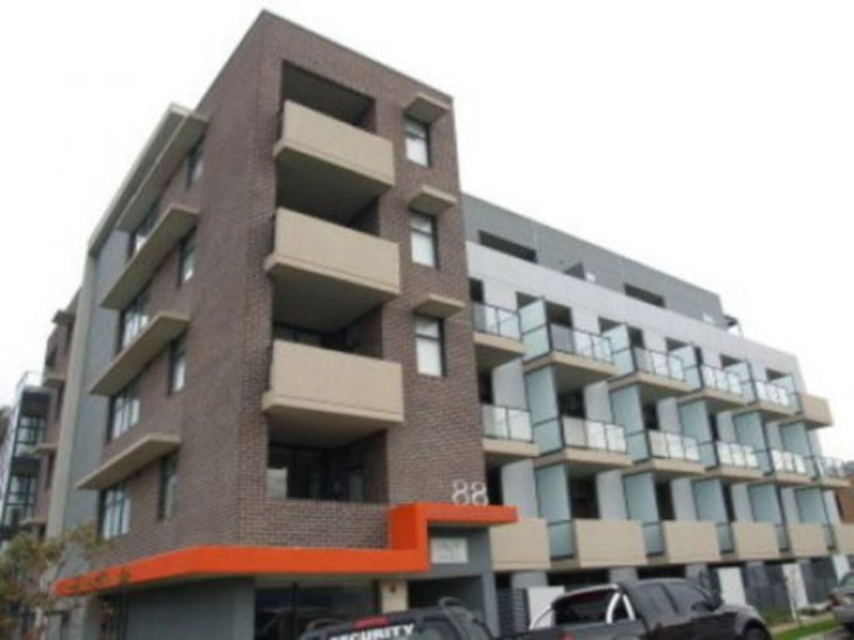
Between shiny black car at lower center and black rubber security car at lower center, which one appears on the left side from the viewer's perspective?

black rubber security car at lower center is more to the left.

Between point (738, 604) and point (413, 608), which one is positioned in front?

Point (413, 608)

Locate an element on the screen. The image size is (854, 640). shiny black car at lower center is located at coordinates (644, 612).

Between shiny black car at lower center and shiny black car at lower right, which one has less height?

shiny black car at lower right

Can you confirm if shiny black car at lower center is shorter than shiny black car at lower right?

No.

Does point (589, 593) come closer to viewer compared to point (834, 605)?

Yes, it is.

Identify the location of shiny black car at lower center. (644, 612).

Find the location of a particular element. black rubber security car at lower center is located at coordinates (405, 625).

Looking at this image, does black rubber security car at lower center have a larger size compared to shiny black car at lower right?

No, black rubber security car at lower center is not bigger than shiny black car at lower right.

Is point (367, 616) behind point (839, 579)?

No, (367, 616) is closer to viewer.

This screenshot has width=854, height=640. Identify the location of black rubber security car at lower center. (405, 625).